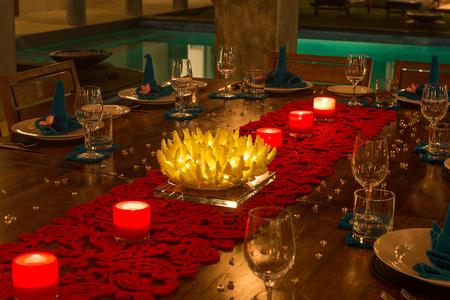
Find the location of a particular element. This screenshot has height=300, width=450. hand towel is located at coordinates 64,122.